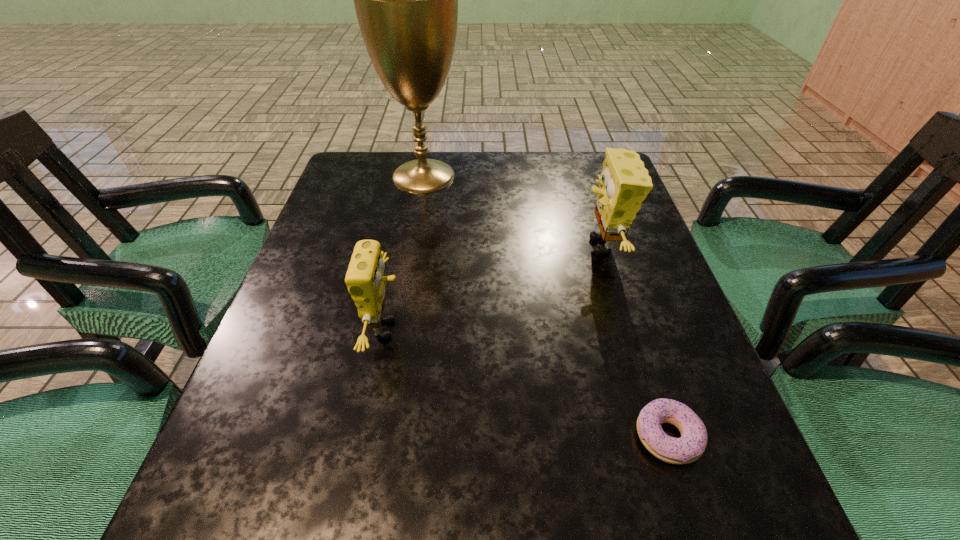
Where is `vacant space at the left edge of the desktop`? Image resolution: width=960 pixels, height=540 pixels. vacant space at the left edge of the desktop is located at coordinates (285, 308).

In the image, there is a desktop. At what (x,y) coordinates should I click in order to perform the action: click on vacant space at the right edge. Please return your answer as a coordinate pair (x, y). The width and height of the screenshot is (960, 540). Looking at the image, I should click on (656, 271).

In the image, there is a desktop. Identify the location of vacant space at the far left corner. (391, 192).

Find the location of a particular element. Image resolution: width=960 pixels, height=540 pixels. vacant space at the near left corner of the desktop is located at coordinates (256, 489).

The width and height of the screenshot is (960, 540). Identify the location of free location at the far right corner of the desktop. (565, 160).

Locate an element on the screen. Image resolution: width=960 pixels, height=540 pixels. vacant space at the near right corner of the desktop is located at coordinates (669, 485).

Where is `vacant point located between the shorter sponge and the right sponge`? vacant point located between the shorter sponge and the right sponge is located at coordinates (494, 288).

Where is `blank region between the trophy cup and the shortest object`? The height and width of the screenshot is (540, 960). blank region between the trophy cup and the shortest object is located at coordinates (545, 306).

Locate an element on the screen. free spot between the farthest object and the shortest object is located at coordinates (545, 306).

The width and height of the screenshot is (960, 540). Find the location of `free space between the nearest object and the third tallest object`. free space between the nearest object and the third tallest object is located at coordinates pyautogui.click(x=527, y=383).